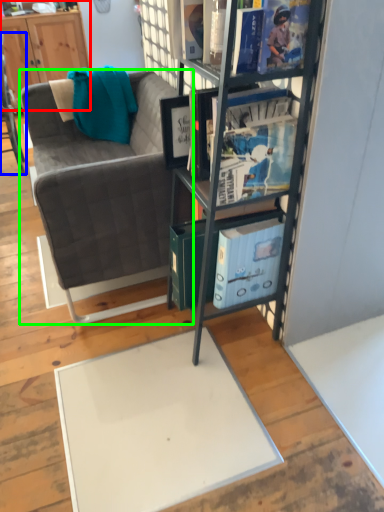
Question: Considering the real-world distances, which object is farthest from cabinetry (highlighted by a red box)? chair (highlighted by a blue box) or studio couch (highlighted by a green box)?

Choices:
 (A) chair
 (B) studio couch

Answer: (B)